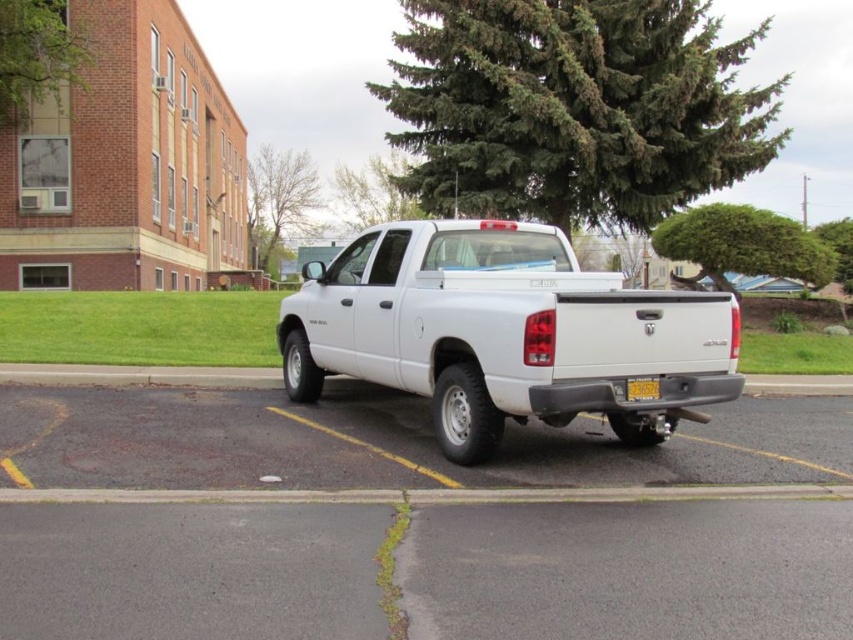
From the picture: Does white matte truck at center have a lesser width compared to green leafy tree at upper right?

No.

Is white matte truck at center to the left of green leafy tree at upper right from the viewer's perspective?

Indeed, white matte truck at center is positioned on the left side of green leafy tree at upper right.

Where is `white matte truck at center`? white matte truck at center is located at coordinates (503, 332).

Does green needle-like leaves at upper center have a larger size compared to green textured tree at upper center?

Indeed, green needle-like leaves at upper center has a larger size compared to green textured tree at upper center.

Is green needle-like leaves at upper center shorter than green textured tree at upper center?

Incorrect, green needle-like leaves at upper center's height does not fall short of green textured tree at upper center's.

The width and height of the screenshot is (853, 640). Find the location of `green needle-like leaves at upper center`. green needle-like leaves at upper center is located at coordinates (573, 108).

From the picture: Can you confirm if green needle-like leaves at upper center is taller than green leafy bush at upper right?

Correct, green needle-like leaves at upper center is much taller as green leafy bush at upper right.

Is point (515, 19) closer to viewer compared to point (813, 250)?

Yes, it is in front of point (813, 250).

Who is more forward, (610, 58) or (721, 280)?

Point (610, 58)

Find the location of a particular element. green needle-like leaves at upper center is located at coordinates (573, 108).